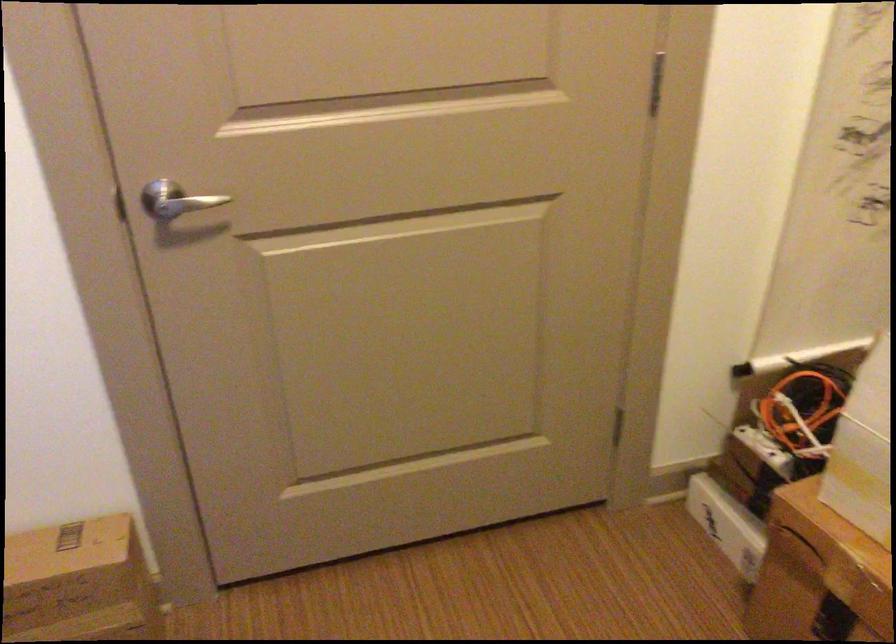
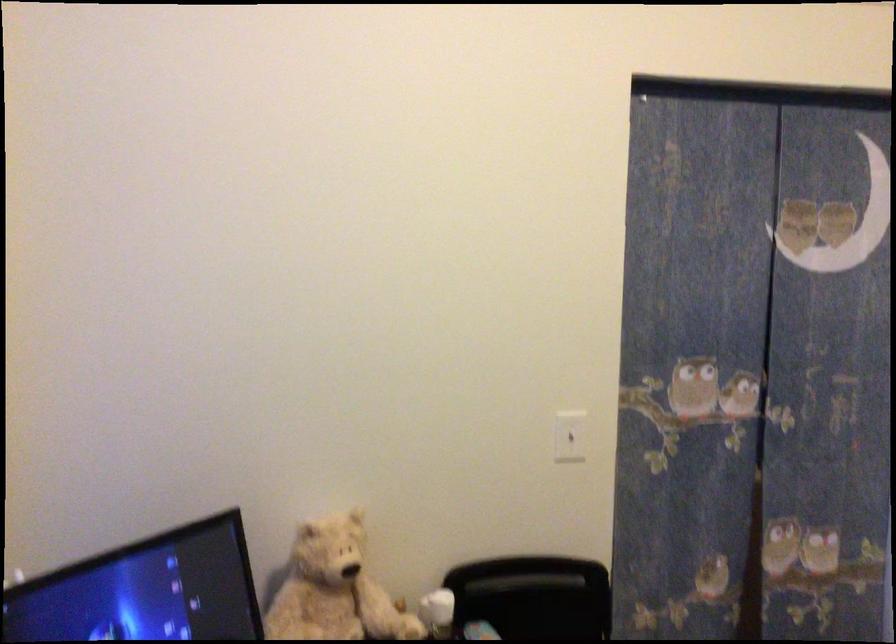
Question: Based on the continuous images, in which direction is the camera rotating? Reply with the corresponding letter.

Choices:
 (A) Left
 (B) Right
 (C) Up
 (D) Down

Answer: (A)